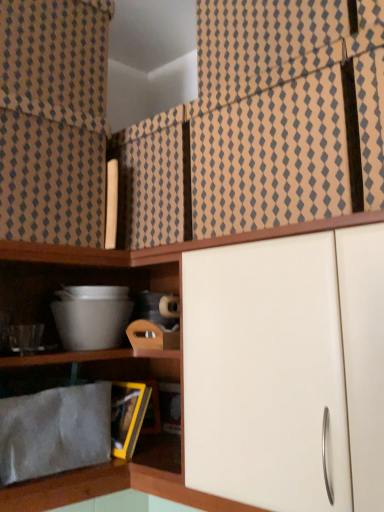
What do you see at coordinates (286, 113) in the screenshot?
I see `brown textured fabric at upper center, which ranks as the 1th curtain in right-to-left order` at bounding box center [286, 113].

Find the location of a particular element. The width and height of the screenshot is (384, 512). brown textured fabric at upper center, which ranks as the 1th curtain in right-to-left order is located at coordinates (286, 113).

From the image's perspective, between gray fabric at lower left and beige textured curtain at upper left, arranged as the 2th curtain when viewed from the right, which one is located above?

beige textured curtain at upper left, arranged as the 2th curtain when viewed from the right, from the image's perspective.

Between gray fabric at lower left and beige textured curtain at upper left, arranged as the 2th curtain when viewed from the right, which one has less height?

Standing shorter between the two is gray fabric at lower left.

Considering the relative sizes of gray fabric at lower left and beige textured curtain at upper left, which ranks as the first curtain in left-to-right order, in the image provided, is gray fabric at lower left thinner than beige textured curtain at upper left, which ranks as the first curtain in left-to-right order,?

Yes.

Could you measure the distance between gray fabric at lower left and beige textured curtain at upper left, arranged as the 2th curtain when viewed from the right?

gray fabric at lower left and beige textured curtain at upper left, arranged as the 2th curtain when viewed from the right, are 20.31 inches apart from each other.

Is brown textured fabric at upper center, the second curtain in the left-to-right sequence, further to the viewer compared to gray fabric at lower left?

No, it is in front of gray fabric at lower left.

Find the location of a particular element. the 1st curtain above the gray fabric at lower left (from a real-world perspective) is located at coordinates (286, 113).

From the image's perspective, is brown textured fabric at upper center, which ranks as the 1th curtain in right-to-left order, below gray fabric at lower left?

Actually, brown textured fabric at upper center, which ranks as the 1th curtain in right-to-left order, appears above gray fabric at lower left in the image.

Are beige textured curtain at upper left, arranged as the 2th curtain when viewed from the right, and gray fabric at lower left far apart?

No.

How much distance is there between beige textured curtain at upper left, arranged as the 2th curtain when viewed from the right, and gray fabric at lower left?

beige textured curtain at upper left, arranged as the 2th curtain when viewed from the right, is 20.31 inches away from gray fabric at lower left.

In the scene shown: What's the angular difference between beige textured curtain at upper left, which ranks as the first curtain in left-to-right order, and gray fabric at lower left's facing directions?

There is a 1.97-degree angle between the facing directions of beige textured curtain at upper left, which ranks as the first curtain in left-to-right order, and gray fabric at lower left.

Is beige textured curtain at upper left, which ranks as the first curtain in left-to-right order, located outside gray fabric at lower left?

That's correct, beige textured curtain at upper left, which ranks as the first curtain in left-to-right order, is outside of gray fabric at lower left.

From the picture: Can you tell me how much brown textured fabric at upper center, which ranks as the 1th curtain in right-to-left order, and beige textured curtain at upper left, arranged as the 2th curtain when viewed from the right, differ in facing direction?

The angle between the facing direction of brown textured fabric at upper center, which ranks as the 1th curtain in right-to-left order, and the facing direction of beige textured curtain at upper left, arranged as the 2th curtain when viewed from the right, is 73.3 degrees.

I want to click on curtain below the beige textured curtain at upper left, arranged as the 2th curtain when viewed from the right (from a real-world perspective), so click(286, 113).

Considering the relative positions of brown textured fabric at upper center, the second curtain in the left-to-right sequence, and beige textured curtain at upper left, arranged as the 2th curtain when viewed from the right, in the image provided, is brown textured fabric at upper center, the second curtain in the left-to-right sequence, behind beige textured curtain at upper left, arranged as the 2th curtain when viewed from the right,?

No, brown textured fabric at upper center, the second curtain in the left-to-right sequence, is closer to the viewer.

Is beige textured curtain at upper left, arranged as the 2th curtain when viewed from the right, at the back of brown textured fabric at upper center, which ranks as the 1th curtain in right-to-left order?

No, beige textured curtain at upper left, arranged as the 2th curtain when viewed from the right, is not at the back of brown textured fabric at upper center, which ranks as the 1th curtain in right-to-left order.

Would you say gray fabric at lower left is inside or outside brown textured fabric at upper center, the second curtain in the left-to-right sequence?

gray fabric at lower left cannot be found inside brown textured fabric at upper center, the second curtain in the left-to-right sequence.

From their relative heights in the image, would you say gray fabric at lower left is taller or shorter than brown textured fabric at upper center, which ranks as the 1th curtain in right-to-left order?

Clearly, gray fabric at lower left is shorter compared to brown textured fabric at upper center, which ranks as the 1th curtain in right-to-left order.

From the image's perspective, does gray fabric at lower left appear lower than brown textured fabric at upper center, the second curtain in the left-to-right sequence?

Correct, gray fabric at lower left appears lower than brown textured fabric at upper center, the second curtain in the left-to-right sequence, in the image.

In the scene shown: Which point is more forward, (56, 452) or (383, 102)?

The point (383, 102) is more forward.

Find the location of `curtain in front of the beige textured curtain at upper left, which ranks as the first curtain in left-to-right order`. curtain in front of the beige textured curtain at upper left, which ranks as the first curtain in left-to-right order is located at coordinates (286, 113).

Can you confirm if beige textured curtain at upper left, which ranks as the first curtain in left-to-right order, is shorter than brown textured fabric at upper center, the second curtain in the left-to-right sequence?

Correct, beige textured curtain at upper left, which ranks as the first curtain in left-to-right order, is not as tall as brown textured fabric at upper center, the second curtain in the left-to-right sequence.

Is beige textured curtain at upper left, arranged as the 2th curtain when viewed from the right, directly adjacent to brown textured fabric at upper center, which ranks as the 1th curtain in right-to-left order?

No.

Considering the sizes of objects beige textured curtain at upper left, arranged as the 2th curtain when viewed from the right, and brown textured fabric at upper center, which ranks as the 1th curtain in right-to-left order, in the image provided, who is smaller, beige textured curtain at upper left, arranged as the 2th curtain when viewed from the right, or brown textured fabric at upper center, which ranks as the 1th curtain in right-to-left order,?

beige textured curtain at upper left, arranged as the 2th curtain when viewed from the right, is smaller.

From the image's perspective, starting from the gray fabric at lower left, which curtain is the 1st one above? Please provide its 2D coordinates.

[(53, 120)]

Identify the location of curtain in front of the gray fabric at lower left. (286, 113).

Estimate the real-world distances between objects in this image. Which object is closer to gray fabric at lower left, brown textured fabric at upper center, the second curtain in the left-to-right sequence, or beige textured curtain at upper left, arranged as the 2th curtain when viewed from the right?

The object closer to gray fabric at lower left is beige textured curtain at upper left, arranged as the 2th curtain when viewed from the right.

Considering their positions, is gray fabric at lower left positioned further to brown textured fabric at upper center, which ranks as the 1th curtain in right-to-left order, than beige textured curtain at upper left, arranged as the 2th curtain when viewed from the right?

Based on the image, gray fabric at lower left appears to be further to brown textured fabric at upper center, which ranks as the 1th curtain in right-to-left order.

Which object lies nearer to the anchor point beige textured curtain at upper left, arranged as the 2th curtain when viewed from the right, gray fabric at lower left or brown textured fabric at upper center, which ranks as the 1th curtain in right-to-left order?

brown textured fabric at upper center, which ranks as the 1th curtain in right-to-left order, lies closer to beige textured curtain at upper left, arranged as the 2th curtain when viewed from the right, than the other object.

Looking at the image, which one is located closer to brown textured fabric at upper center, which ranks as the 1th curtain in right-to-left order, beige textured curtain at upper left, arranged as the 2th curtain when viewed from the right, or gray fabric at lower left?

beige textured curtain at upper left, arranged as the 2th curtain when viewed from the right, lies closer to brown textured fabric at upper center, which ranks as the 1th curtain in right-to-left order, than the other object.

Which object lies nearer to the anchor point gray fabric at lower left, beige textured curtain at upper left, arranged as the 2th curtain when viewed from the right, or brown textured fabric at upper center, the second curtain in the left-to-right sequence?

Based on the image, beige textured curtain at upper left, arranged as the 2th curtain when viewed from the right, appears to be nearer to gray fabric at lower left.

Based on their spatial positions, is brown textured fabric at upper center, which ranks as the 1th curtain in right-to-left order, or gray fabric at lower left further from beige textured curtain at upper left, which ranks as the first curtain in left-to-right order?

gray fabric at lower left is further to beige textured curtain at upper left, which ranks as the first curtain in left-to-right order.

At what (x,y) coordinates should I click in order to perform the action: click on curtain between brown textured fabric at upper center, which ranks as the 1th curtain in right-to-left order, and gray fabric at lower left from top to bottom. Please return your answer as a coordinate pair (x, y). Image resolution: width=384 pixels, height=512 pixels. Looking at the image, I should click on (53, 120).